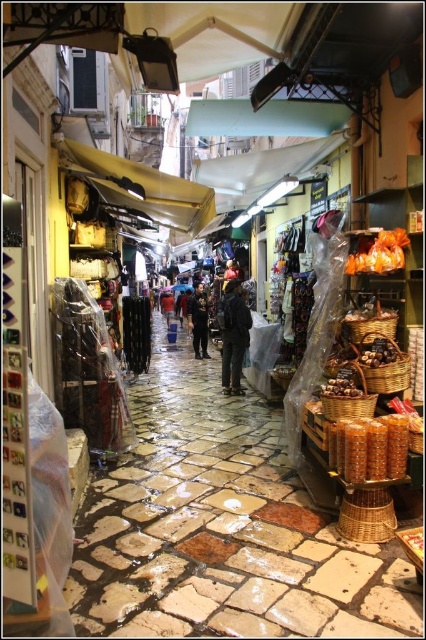
You are a customer in the market and want to pick up the matte wicker basket at center and the dark blue jeans at center. Which item should you move towards first if you are standing to the left of both items?

You should move towards the dark blue jeans at center first because the matte wicker basket at center is positioned to the right of the dark blue jeans at center, meaning the dark blue jeans at center is closer to your left position.

In the scene shown: You are a customer in the market and want to place the dark blue jeans at center into the matte wicker basket at center. Will the jeans fit inside the basket?

The matte wicker basket at center is shorter than the dark blue jeans at center, so the jeans will not fit inside the basket.

You are standing at the entrance of the market and want to reach a specific point in the middle of the market. The point is marked as point (207, 307). Considering the narrowness of the street and the obstacles like the shops and their awnings, can you estimate how far you need to walk to reach that point?

The distance of point (207, 307) from camera is 44.87 feet, so you need to walk approximately 44.87 feet to reach that point.